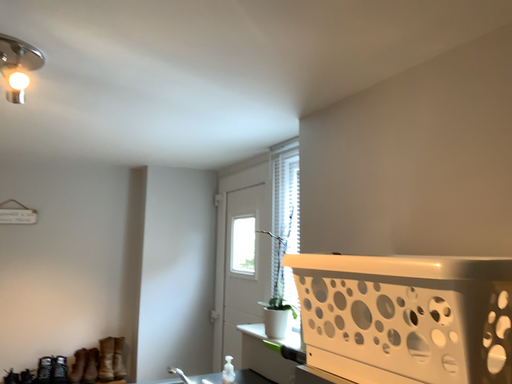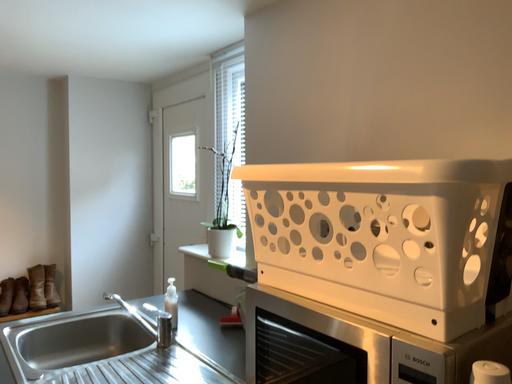
Question: How did the camera likely rotate when shooting the video?

Choices:
 (A) rotated downward
 (B) rotated upward

Answer: (A)